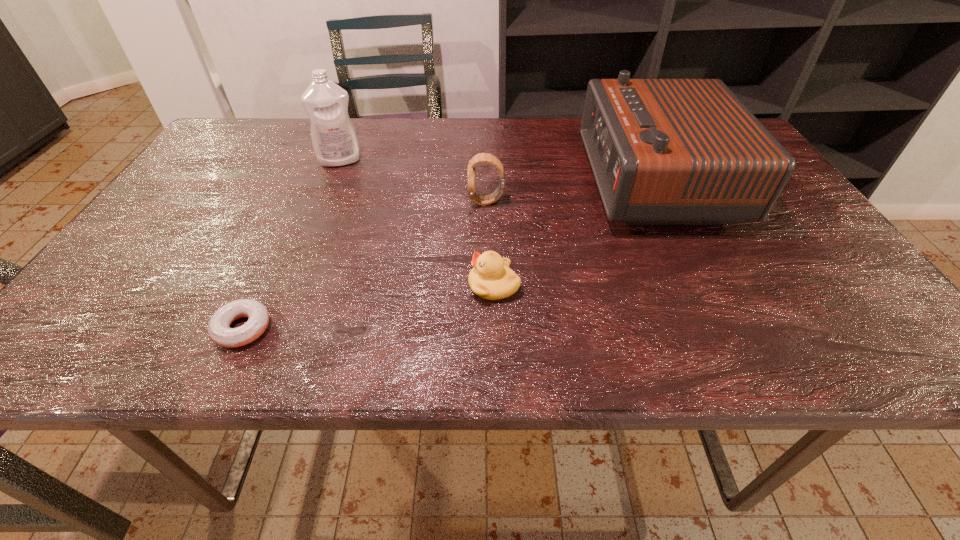
Identify the location of detergent. 334,139.

Locate an element on the screen. The image size is (960, 540). the rightmost object is located at coordinates (663, 151).

Locate an element on the screen. The height and width of the screenshot is (540, 960). the third tallest object is located at coordinates (481, 157).

At what (x,y) coordinates should I click in order to perform the action: click on the fourth farthest object. Please return your answer as a coordinate pair (x, y). The width and height of the screenshot is (960, 540). Looking at the image, I should click on (491, 278).

Identify the location of the fourth tallest object. The width and height of the screenshot is (960, 540). (491, 278).

This screenshot has width=960, height=540. Identify the location of the nearest object. (219, 330).

Find the location of a particular element. This screenshot has height=540, width=960. doughnut is located at coordinates (219, 330).

Image resolution: width=960 pixels, height=540 pixels. I want to click on vacant space situated 0.140m on the right of the detergent, so click(x=415, y=160).

Find the location of a particular element. The width and height of the screenshot is (960, 540). free space located 0.280m on the tuning display of the radio receiver is located at coordinates (474, 183).

At what (x,y) coordinates should I click in order to perform the action: click on vacant space located on the tuning display of the radio receiver. Please return your answer as a coordinate pair (x, y). This screenshot has width=960, height=540. Looking at the image, I should click on (536, 183).